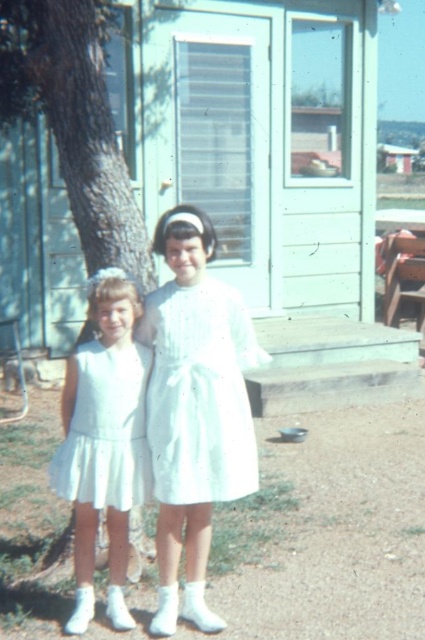
You are a fashion designer observing two dresses displayed in front of a house. You need to determine which dress is taller. The dresses are the white pleated dress at center and the white satin dress at left. Which one is taller?

The white pleated dress at center is taller than the white satin dress at left according to the description.

You are a photographer trying to capture the green textured tree trunk at left and the white pleated dress at center. Based on their positions, which object is higher in the image?

The green textured tree trunk at left is located above the white pleated dress at center, so it is higher in the image.